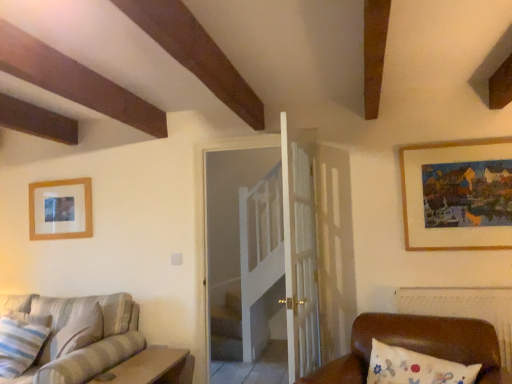
Question: Can you confirm if white wooden door at center is bigger than wooden table at lower left?

Choices:
 (A) yes
 (B) no

Answer: (A)

Question: Is white wooden door at center smaller than wooden table at lower left?

Choices:
 (A) yes
 (B) no

Answer: (B)

Question: Is white wooden door at center positioned with its back to wooden table at lower left?

Choices:
 (A) no
 (B) yes

Answer: (A)

Question: Is the surface of white wooden door at center in direct contact with wooden table at lower left?

Choices:
 (A) yes
 (B) no

Answer: (B)

Question: Is white wooden door at center oriented towards wooden table at lower left?

Choices:
 (A) yes
 (B) no

Answer: (B)

Question: Is white wooden door at center far from wooden table at lower left?

Choices:
 (A) no
 (B) yes

Answer: (B)

Question: Is the position of striped fabric couch at lower left more distant than that of wooden framed painting at upper right, the 1th picture frame from the right?

Choices:
 (A) yes
 (B) no

Answer: (B)

Question: From the image's perspective, is striped fabric couch at lower left located above wooden framed painting at upper right, marked as the first picture frame in a front-to-back arrangement?

Choices:
 (A) no
 (B) yes

Answer: (A)

Question: From a real-world perspective, is striped fabric couch at lower left physically above wooden framed painting at upper right, marked as the first picture frame in a front-to-back arrangement?

Choices:
 (A) yes
 (B) no

Answer: (B)

Question: Are striped fabric couch at lower left and wooden framed painting at upper right, the 1th picture frame from the right, making contact?

Choices:
 (A) no
 (B) yes

Answer: (A)

Question: Is striped fabric couch at lower left thinner than wooden framed painting at upper right, the 1th picture frame from the right?

Choices:
 (A) yes
 (B) no

Answer: (B)

Question: Is striped fabric couch at lower left oriented away from wooden framed painting at upper right, the 1th picture frame from the right?

Choices:
 (A) no
 (B) yes

Answer: (A)

Question: Does wooden framed painting at upper right, marked as the first picture frame in a front-to-back arrangement, have a greater height compared to striped fabric pillow at lower left?

Choices:
 (A) no
 (B) yes

Answer: (B)